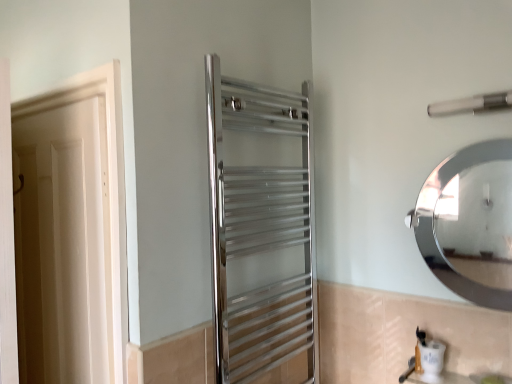
Question: Is white matte door at left to the left or to the right of satin nickel towel bar at upper right in the image?

Choices:
 (A) right
 (B) left

Answer: (B)

Question: From the image's perspective, is white matte door at left positioned above or below satin nickel towel bar at upper right?

Choices:
 (A) below
 (B) above

Answer: (A)

Question: Estimate the real-world distances between objects in this image. Which object is farther from the satin nickel towel bar at upper right?

Choices:
 (A) white matte door at left
 (B) polished chrome towel rack at center, the second screen door positioned from the left
 (C) white wood screen door at left, arranged as the 1th screen door when viewed from the left

Answer: (C)

Question: Estimate the real-world distances between objects in this image. Which object is closer to the white matte door at left?

Choices:
 (A) polished chrome towel rack at center, placed as the 1th screen door when sorted from right to left
 (B) white wood screen door at left, arranged as the 1th screen door when viewed from the left
 (C) satin nickel towel bar at upper right

Answer: (B)